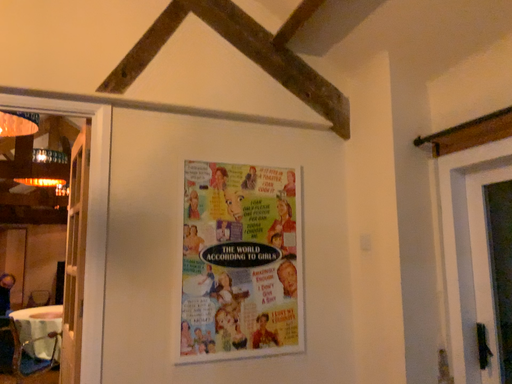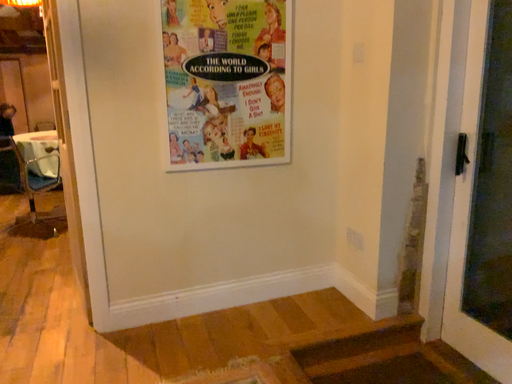
Question: How did the camera likely rotate when shooting the video?

Choices:
 (A) rotated upward
 (B) rotated downward

Answer: (B)